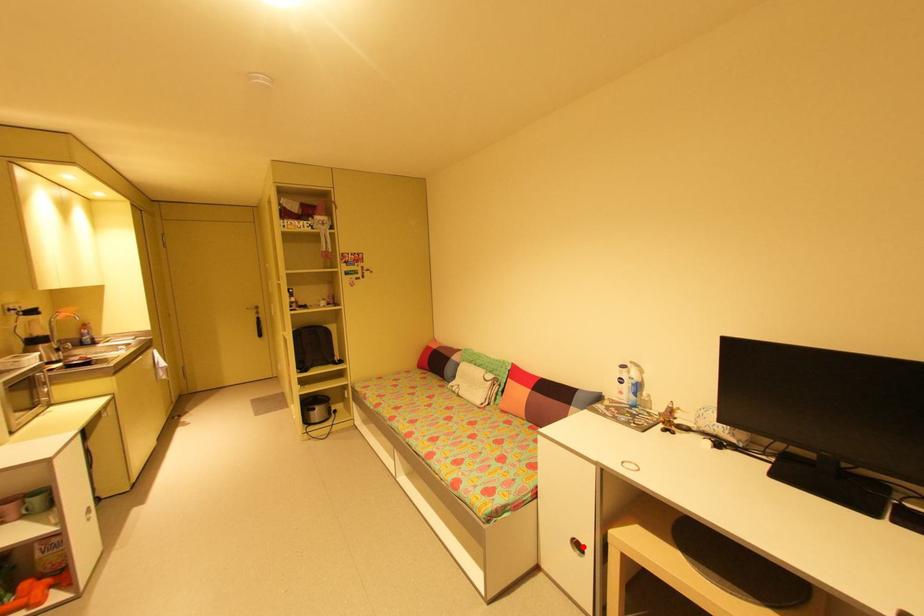
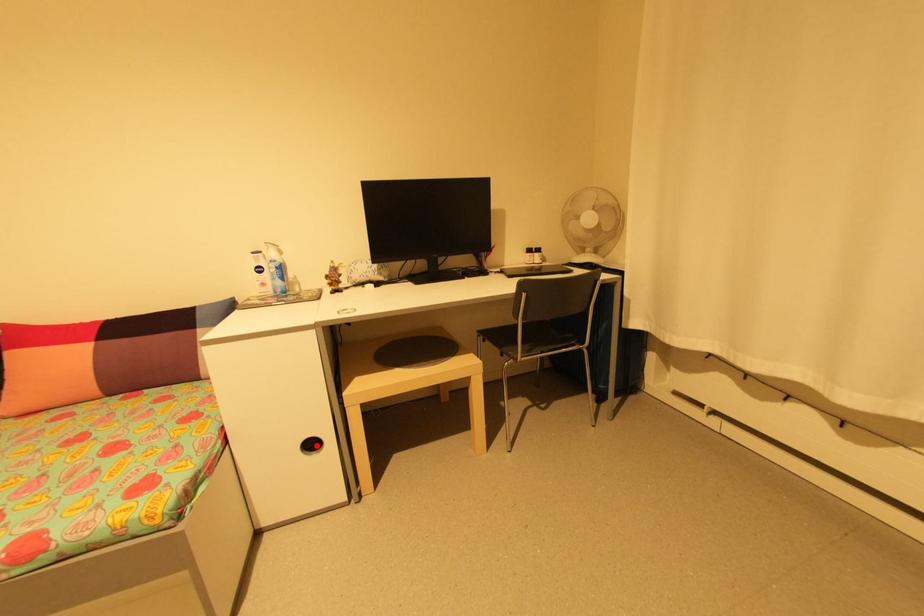
I am providing you with two images of the same scene from different viewpoints. A red point is marked on the first image and another point is marked on the second image. Does the point marked in image1 correspond to the same location as the one in image2?

Yes